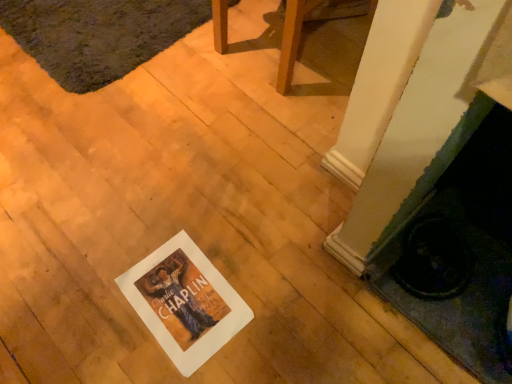
Locate an element on the screen. The height and width of the screenshot is (384, 512). free space above white paper at center (from a real-world perspective) is located at coordinates (187, 296).